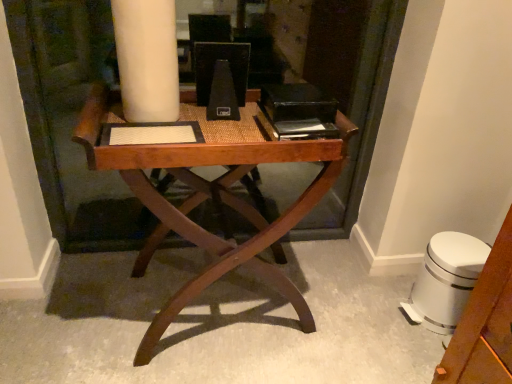
Locate an element on the screen. The width and height of the screenshot is (512, 384). vacant area that lies between wooden desk at center and white plastic swivel chair at lower right is located at coordinates (342, 298).